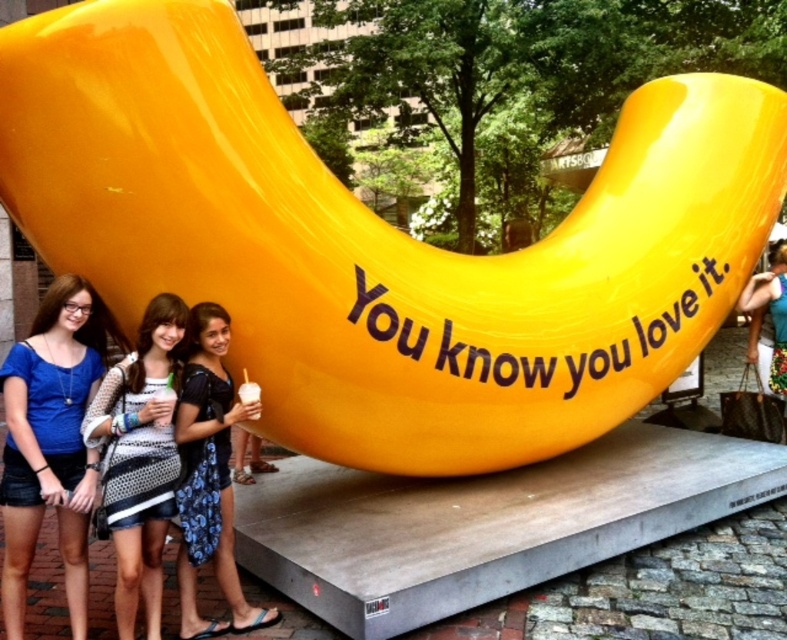
You are standing in front of the yellow banana sculpture and see the two people wearing the matte blue shirt at center and the matte black dress at center. Which person is standing closer to you?

The matte blue shirt at center is closer to the viewer than the matte black dress at center, so the person wearing the matte blue shirt at center is standing closer to you.

You are a photographer trying to capture a clear shot of both the matte blue shirt at center and the matte black dress at center. Since you want both to be visible, which one should you focus on first to ensure depth of field?

Since the matte blue shirt at center is larger in size than the matte black dress at center, you should focus on the matte blue shirt at center first to ensure both are in focus.

You are a photographer trying to capture the two women in the scene. The women are wearing the matte black dress at center and carrying the printed fabric purse at right. Which one should you focus on first if you want to capture them from left to right in the frame?

You should focus on the woman wearing the matte black dress at center first because she is positioned to the left of the printed fabric purse at right, so she will appear first when viewed from left to right.